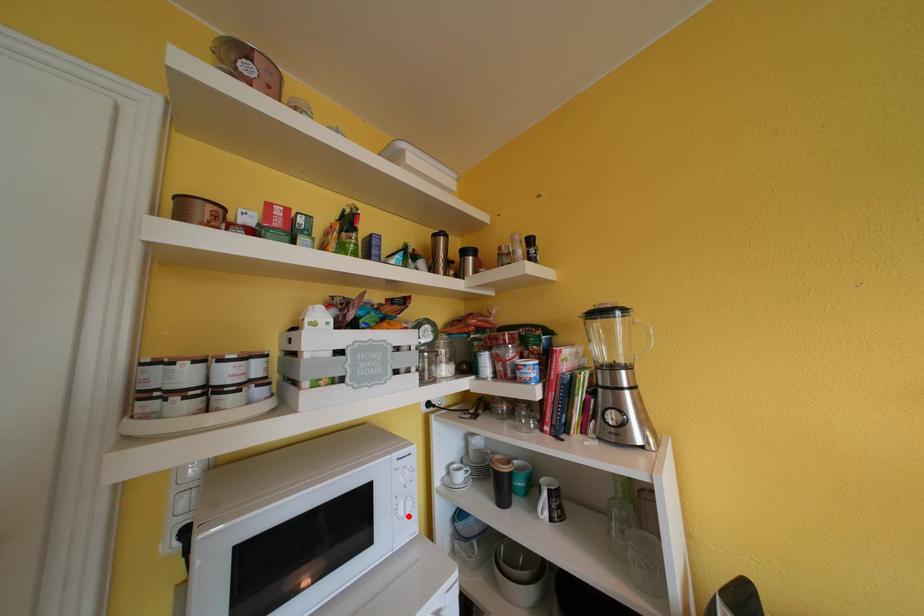
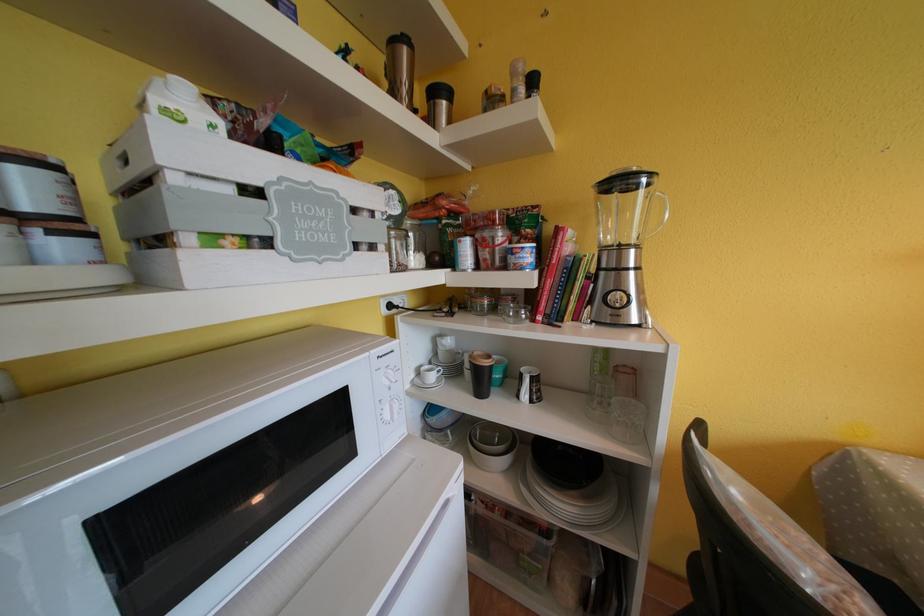
Where in the second image is the point corresponding to the highlighted location from the first image?

(394, 421)